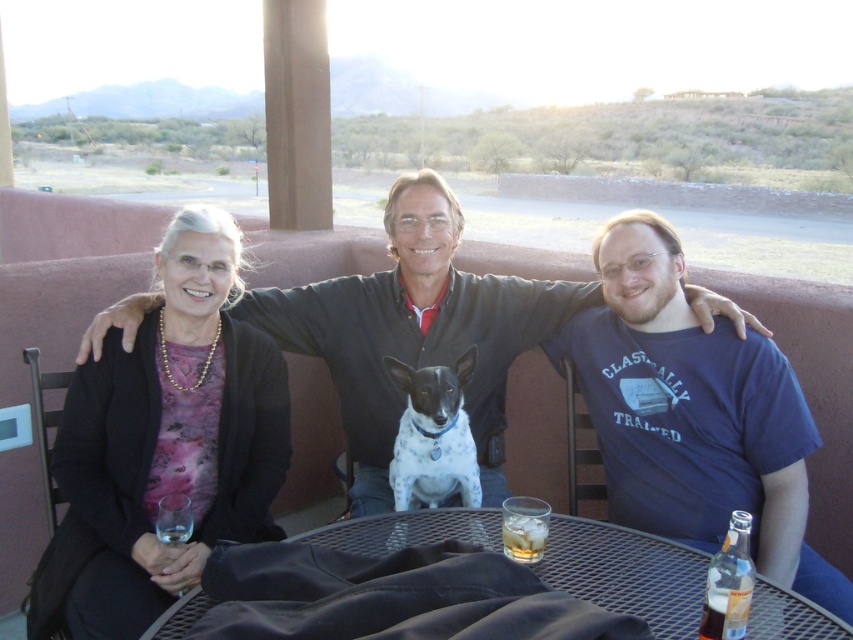
Which is behind, point (646, 408) or point (743, 525)?

The point (646, 408) is behind.

This screenshot has width=853, height=640. What do you see at coordinates (693, 413) in the screenshot? I see `blue cotton shirt at center` at bounding box center [693, 413].

Find the location of a particular element. blue cotton shirt at center is located at coordinates (693, 413).

Can you confirm if clear glass bottle at lower right is smaller than clear glass ice at table center?

No, clear glass bottle at lower right is not smaller than clear glass ice at table center.

Which is more to the left, clear glass bottle at lower right or clear glass ice at table center?

clear glass ice at table center is more to the left.

Looking at this image, who is more forward, (721, 628) or (503, 532)?

Positioned in front is point (721, 628).

This screenshot has width=853, height=640. What are the coordinates of `clear glass bottle at lower right` in the screenshot? It's located at (729, 582).

Does blue cotton shirt at center have a greater height compared to clear glass at lower left?

Yes.

The width and height of the screenshot is (853, 640). What do you see at coordinates (693, 413) in the screenshot?
I see `blue cotton shirt at center` at bounding box center [693, 413].

Which is in front, point (630, 440) or point (184, 540)?

Positioned in front is point (184, 540).

What are the coordinates of `blue cotton shirt at center` in the screenshot? It's located at (693, 413).